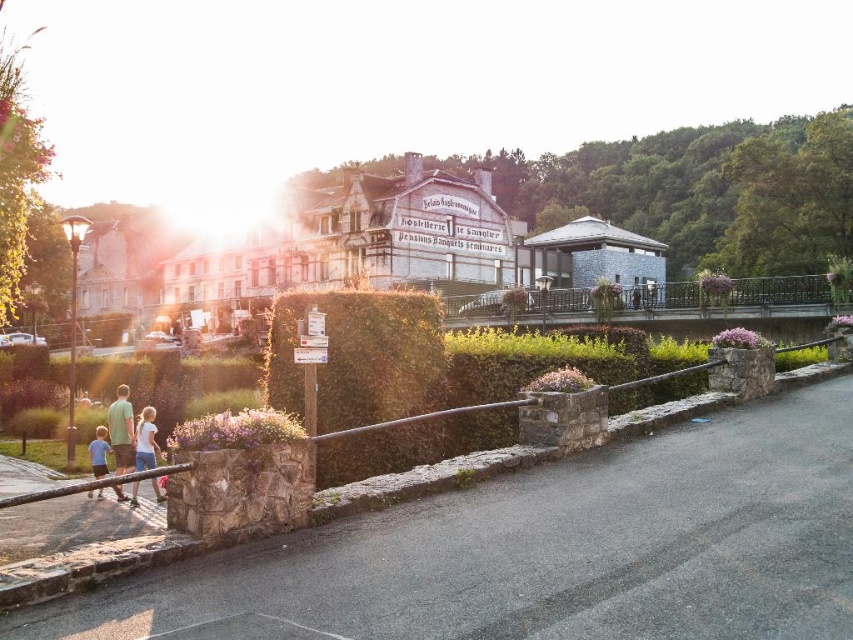
You are a tourist standing on the path near the blue cotton shirt at lower left. You want to take a photo of the white wooden hotel at center. Which direction should you face to ensure the hotel is fully visible in your photo?

You should face towards the center of the scene because the white wooden hotel at center is taller than the blue cotton shirt at lower left, so facing towards the center will ensure the hotel is fully visible without obstruction.

You are a tourist in the village and want to take a photo of the white wooden hotel at center and the blue cotton shirt at lower left together in the frame. Which object should you focus on first to ensure both are in the shot?

You should focus on the white wooden hotel at center first because it is larger in size than the blue cotton shirt at lower left, so it will be easier to frame both objects by centering on the larger one.

You are standing at the point with coordinates 0.3, 0.6 in the scene. You want to walk to the gray stone building at center. In which direction should you walk? Please answer with either north, south, east, or west.

You should walk north to reach the gray stone building at center because your current position is at (511, 192) and the building is at (596, 257). Since the y coordinate increases northward, moving towards higher y values means going north.